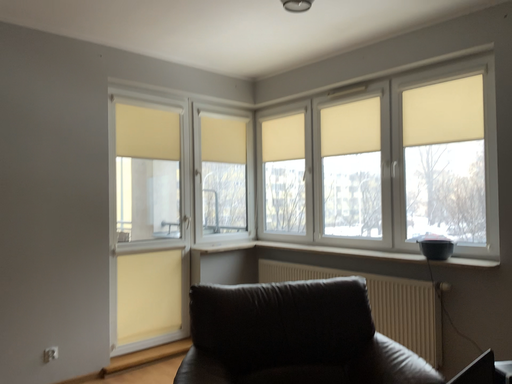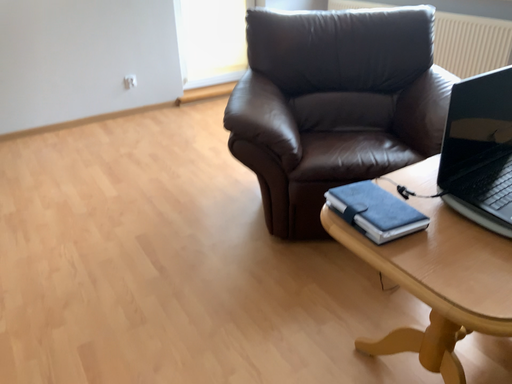
Question: How did the camera likely rotate when shooting the video?

Choices:
 (A) rotated downward
 (B) rotated upward

Answer: (A)